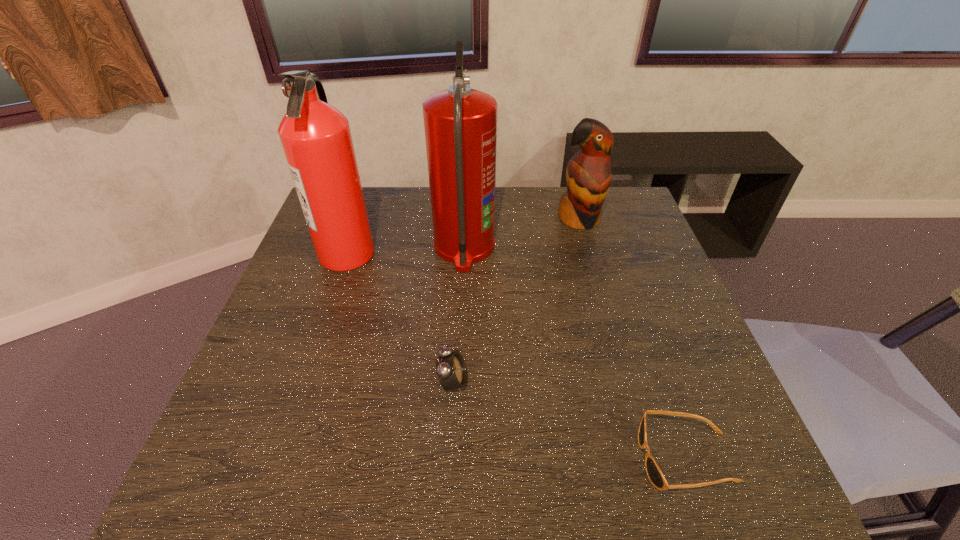
Identify the location of free space between the nearest object and the left fire extinguisher. The image size is (960, 540). (516, 355).

The height and width of the screenshot is (540, 960). In order to click on free space between the right fire extinguisher and the shortest object in this screenshot , I will do `click(575, 353)`.

Locate an element on the screen. vacant space that's between the parrot and the sunglasses is located at coordinates pyautogui.click(x=633, y=339).

You are a GUI agent. You are given a task and a screenshot of the screen. Output one action in this format:
    pyautogui.click(x=<x>, y=<y>)
    Task: Click on the empty space that is in between the nearest object and the right fire extinguisher
    
    Given the screenshot: What is the action you would take?
    pyautogui.click(x=575, y=353)

The image size is (960, 540). I want to click on free spot between the fourth farthest object and the left fire extinguisher, so click(x=400, y=318).

Image resolution: width=960 pixels, height=540 pixels. Find the location of `vacant region between the nearest object and the leftmost object`. vacant region between the nearest object and the leftmost object is located at coordinates (516, 355).

At what (x,y) coordinates should I click in order to perform the action: click on vacant area that lies between the parrot and the second shortest object. Please return your answer as a coordinate pair (x, y). The width and height of the screenshot is (960, 540). Looking at the image, I should click on (516, 301).

Identify which object is located as the third nearest to the right fire extinguisher. Please provide its 2D coordinates. Your answer should be formatted as a tuple, i.e. [(x, y)], where the tuple contains the x and y coordinates of a point satisfying the conditions above.

[(451, 370)]

This screenshot has height=540, width=960. Find the location of `object that stands as the closest to the second shortest object`. object that stands as the closest to the second shortest object is located at coordinates (460, 123).